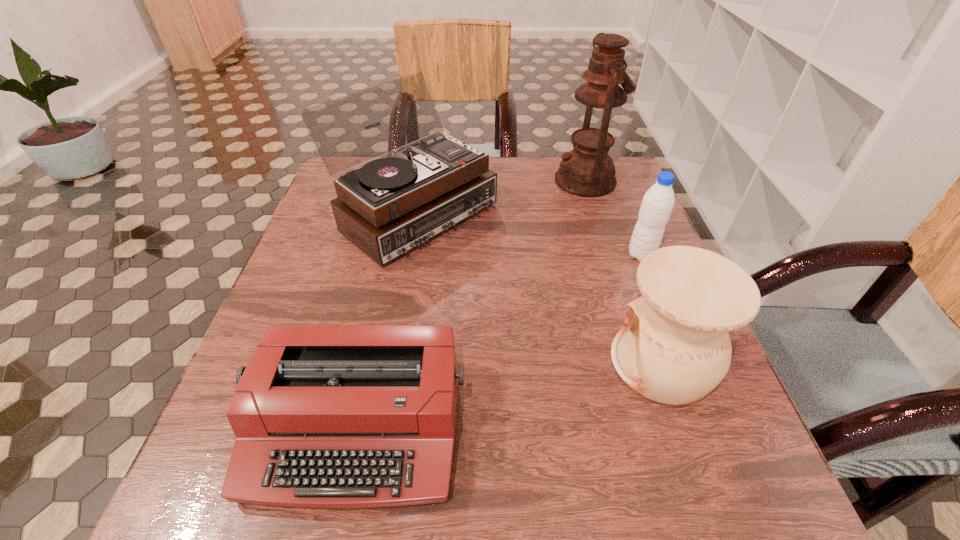
In order to click on vacant space that's between the tallest object and the water bottle in this screenshot , I will do `click(613, 218)`.

Where is `blank region between the water bottle and the shortest object`? This screenshot has height=540, width=960. blank region between the water bottle and the shortest object is located at coordinates (499, 341).

The image size is (960, 540). In order to click on free space that is in between the shortest object and the record player in this screenshot , I will do `click(385, 320)`.

Image resolution: width=960 pixels, height=540 pixels. What are the coordinates of `free point between the shortest object and the water bottle` in the screenshot? It's located at point(499,341).

Locate an element on the screen. The image size is (960, 540). the fourth closest object to the oil lamp is located at coordinates (325, 416).

Where is `object identified as the fourth closest to the record player`? object identified as the fourth closest to the record player is located at coordinates (658, 202).

The width and height of the screenshot is (960, 540). Find the location of `free spot that satisfies the following two spatial constraints: 1. on the front side of the tallest object; 2. on the right side of the water bottle`. free spot that satisfies the following two spatial constraints: 1. on the front side of the tallest object; 2. on the right side of the water bottle is located at coordinates (609, 255).

In order to click on free space that satisfies the following two spatial constraints: 1. at the open side of the pottery; 2. on the typing side of the shortest object in this screenshot , I will do `click(684, 427)`.